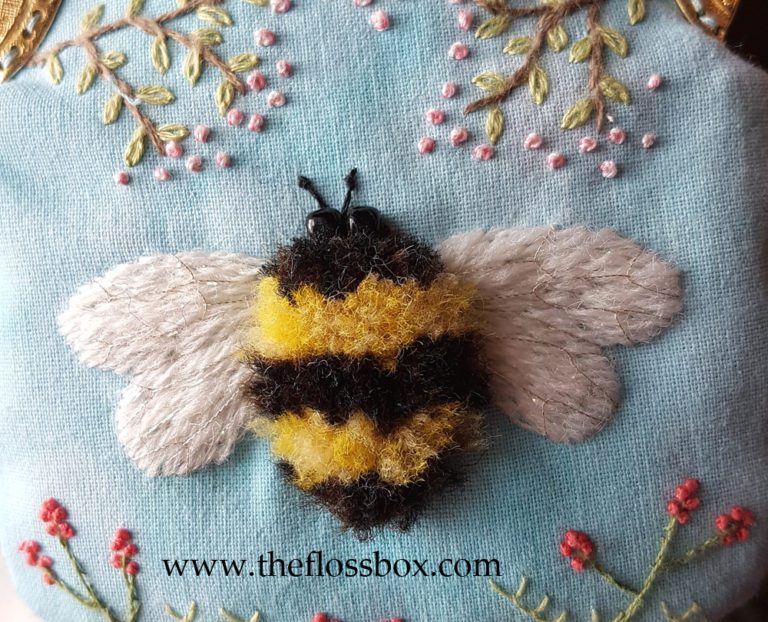
The width and height of the screenshot is (768, 622). Find the location of `yellow fabric`. yellow fabric is located at coordinates point(353,322), point(349,446).